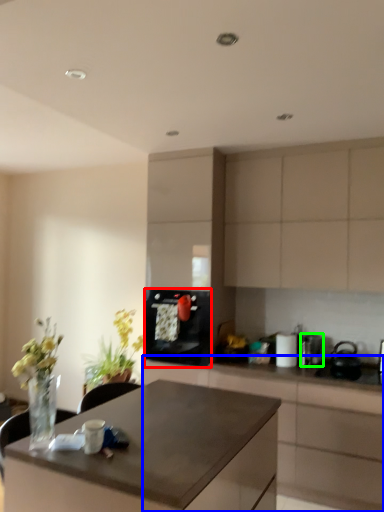
Question: Which object is positioned farthest from kitchen appliance (highlighted by a red box)? Select from cabinetry (highlighted by a blue box) and appliance (highlighted by a green box).

Choices:
 (A) cabinetry
 (B) appliance

Answer: (B)